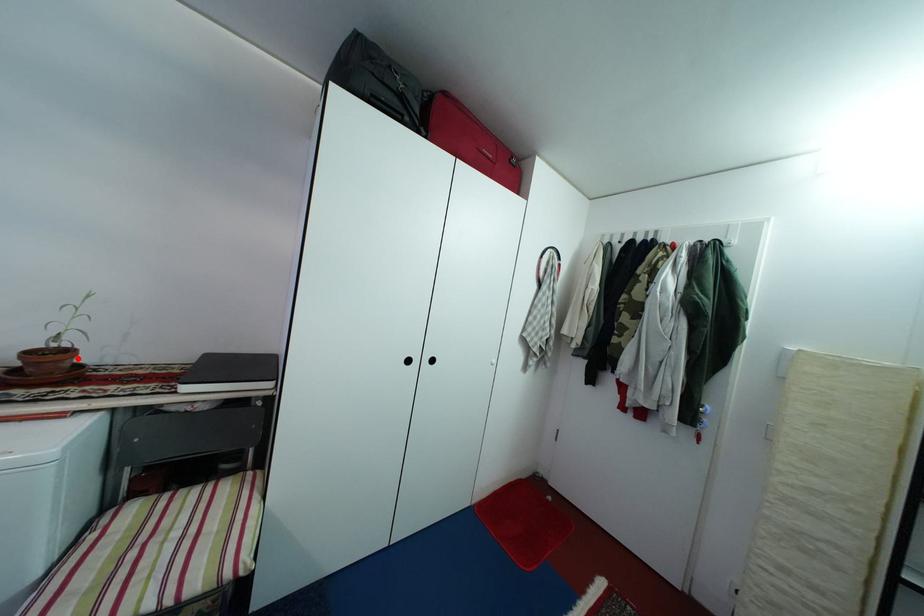
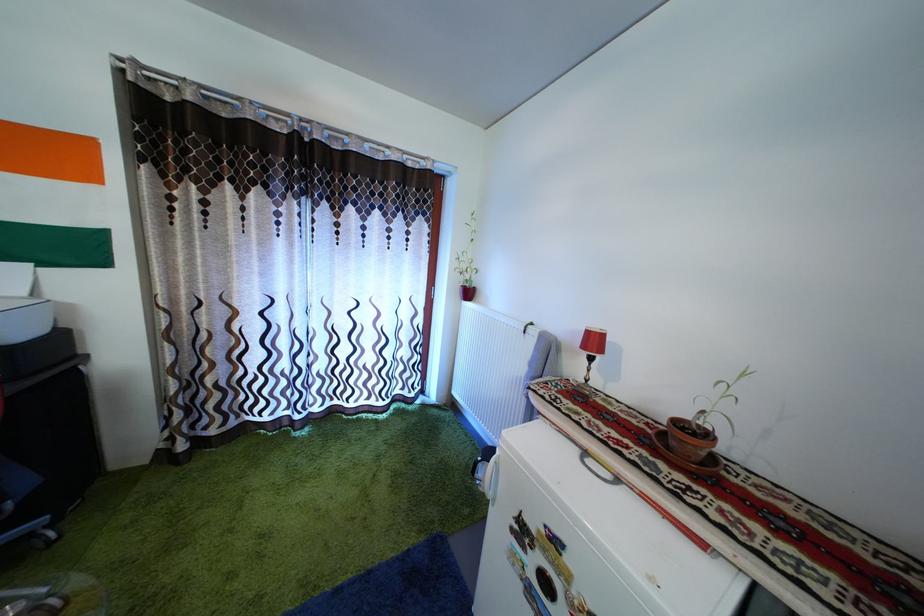
Where in the second image is the point corresponding to the highlighted location from the first image?

(715, 442)